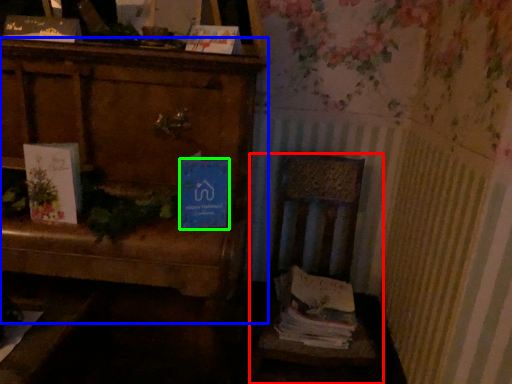
Question: Estimate the real-world distances between objects in this image. Which object is closer to chair (highlighted by a red box), furniture (highlighted by a blue box) or paperback book (highlighted by a green box)?

Choices:
 (A) furniture
 (B) paperback book

Answer: (A)